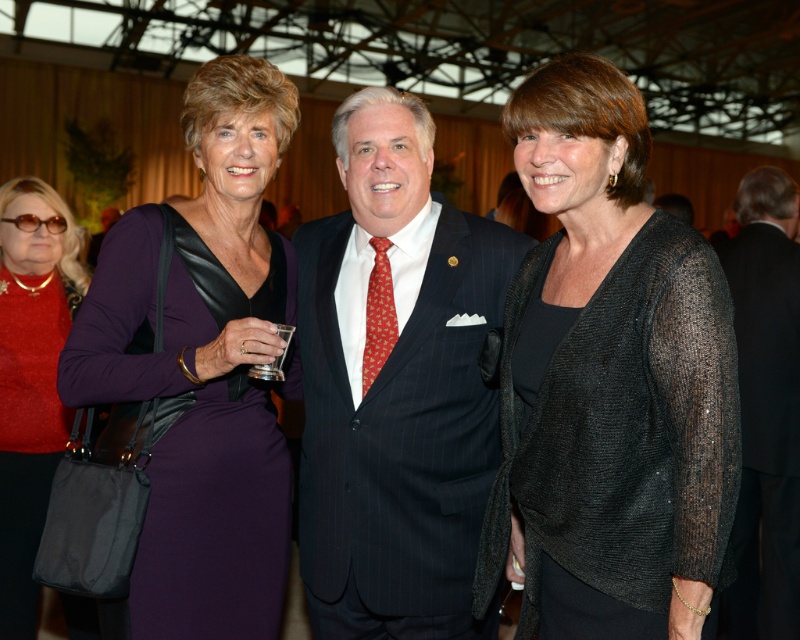
Question: Does pinstriped suit at center appear on the left side of red silk tie at center?

Choices:
 (A) yes
 (B) no

Answer: (B)

Question: Can you confirm if black sheer cardigan at center is wider than shiny black suit at center?

Choices:
 (A) no
 (B) yes

Answer: (B)

Question: Which object is the closest to the pinstriped suit at center?

Choices:
 (A) shiny black suit at center
 (B) purple satin dress at center

Answer: (B)

Question: Can you confirm if black sheer cardigan at center is positioned below shiny red sweater at upper left?

Choices:
 (A) no
 (B) yes

Answer: (A)

Question: Among these objects, which one is nearest to the camera?

Choices:
 (A) purple satin dress at center
 (B) shiny red sweater at upper left

Answer: (A)

Question: Which of the following is the closest to the observer?

Choices:
 (A) purple satin dress at center
 (B) pinstriped suit at center
 (C) red silk tie at center
 (D) black sheer cardigan at center

Answer: (D)